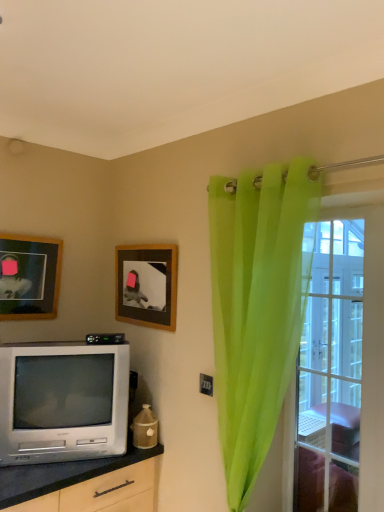
Question: Considering the relative sizes of clear glass door at right and wooden picture frame at upper center, which is counted as the 2th picture frame, starting from the left, in the image provided, is clear glass door at right smaller than wooden picture frame at upper center, which is counted as the 2th picture frame, starting from the left,?

Choices:
 (A) no
 (B) yes

Answer: (A)

Question: Is wooden picture frame at upper center, which is counted as the 2th picture frame, starting from the left, a part of clear glass door at right?

Choices:
 (A) no
 (B) yes

Answer: (A)

Question: Considering the relative sizes of clear glass door at right and wooden picture frame at upper center, marked as the 1th picture frame in a right-to-left arrangement, in the image provided, is clear glass door at right taller than wooden picture frame at upper center, marked as the 1th picture frame in a right-to-left arrangement,?

Choices:
 (A) yes
 (B) no

Answer: (A)

Question: Are clear glass door at right and wooden picture frame at upper center, marked as the 1th picture frame in a right-to-left arrangement, making contact?

Choices:
 (A) no
 (B) yes

Answer: (A)

Question: Can you confirm if clear glass door at right is positioned to the right of wooden picture frame at upper center, which is counted as the 2th picture frame, starting from the left?

Choices:
 (A) no
 (B) yes

Answer: (B)

Question: From a real-world perspective, is clear glass door at right on top of wooden picture frame at upper center, which is counted as the 2th picture frame, starting from the left?

Choices:
 (A) no
 (B) yes

Answer: (A)

Question: Does translucent green curtain at right turn towards silver metallic television at lower left?

Choices:
 (A) no
 (B) yes

Answer: (A)

Question: Is translucent green curtain at right looking in the opposite direction of silver metallic television at lower left?

Choices:
 (A) no
 (B) yes

Answer: (A)

Question: Can you confirm if translucent green curtain at right is positioned to the right of silver metallic television at lower left?

Choices:
 (A) yes
 (B) no

Answer: (A)

Question: Is translucent green curtain at right positioned behind silver metallic television at lower left?

Choices:
 (A) no
 (B) yes

Answer: (A)

Question: Can you confirm if translucent green curtain at right is positioned to the left of silver metallic television at lower left?

Choices:
 (A) yes
 (B) no

Answer: (B)

Question: Considering the relative sizes of translucent green curtain at right and silver metallic television at lower left in the image provided, is translucent green curtain at right thinner than silver metallic television at lower left?

Choices:
 (A) yes
 (B) no

Answer: (A)

Question: From the image's perspective, is clear glass door at right located above translucent green curtain at right?

Choices:
 (A) yes
 (B) no

Answer: (B)